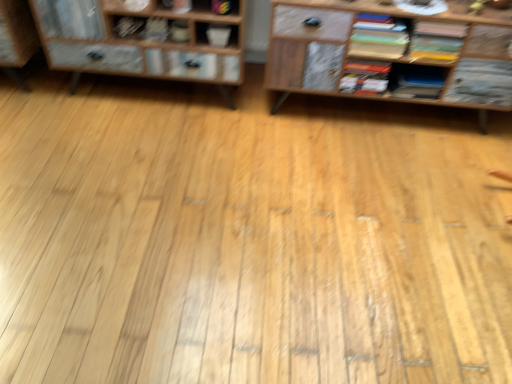
Question: Visually, is matte black book at upper left, placed as the first book when sorted from left to right, positioned to the left or to the right of multicolored paper stack at upper right, the 3th book from the right?

Choices:
 (A) left
 (B) right

Answer: (A)

Question: Looking at the image, does matte black book at upper left, which appears as the sixth book when viewed from the right, seem bigger or smaller compared to multicolored paper stack at upper right, the 4th book from the left?

Choices:
 (A) big
 (B) small

Answer: (B)

Question: Estimate the real-world distances between objects in this image. Which object is farther from the matte yellow book at upper right, marked as the sixth book in a left-to-right arrangement?

Choices:
 (A) wooden cabinet at left
 (B) matte gray book at upper center, marked as the 2th book in a left-to-right arrangement
 (C) multicolored paper stack at upper right, the 3th book from the right
 (D) matte black book at center right, which is the 5th book from left to right
 (E) hardcover book at center, the 4th book in the right-to-left sequence

Answer: (B)

Question: Estimate the real-world distances between objects in this image. Which object is farther from the multicolored paper stack at upper right, the 3th book from the right?

Choices:
 (A) hardcover book at center, which ranks as the 3th book in left-to-right order
 (B) matte yellow book at upper right, marked as the sixth book in a left-to-right arrangement
 (C) matte gray book at upper center, marked as the 5th book in a right-to-left arrangement
 (D) wooden cabinet at left
 (E) matte black book at upper left, which appears as the sixth book when viewed from the right

Answer: (E)